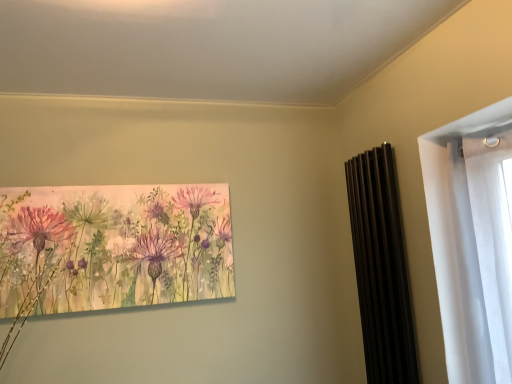
Question: From the image's perspective, is black matte radiator at right under watercolor painting of flowers at center?

Choices:
 (A) no
 (B) yes

Answer: (B)

Question: Considering the relative sizes of black matte radiator at right and watercolor painting of flowers at center in the image provided, is black matte radiator at right smaller than watercolor painting of flowers at center?

Choices:
 (A) yes
 (B) no

Answer: (B)

Question: Is black matte radiator at right turned away from watercolor painting of flowers at center?

Choices:
 (A) no
 (B) yes

Answer: (A)

Question: Is the position of black matte radiator at right more distant than that of watercolor painting of flowers at center?

Choices:
 (A) no
 (B) yes

Answer: (A)

Question: Are black matte radiator at right and watercolor painting of flowers at center far apart?

Choices:
 (A) yes
 (B) no

Answer: (A)

Question: Is watercolor painting of flowers at center a part of black matte radiator at right?

Choices:
 (A) no
 (B) yes

Answer: (A)

Question: Is watercolor painting of flowers at center closer to the viewer compared to black matte radiator at right?

Choices:
 (A) no
 (B) yes

Answer: (A)

Question: Could you tell me if watercolor painting of flowers at center is facing black matte radiator at right?

Choices:
 (A) no
 (B) yes

Answer: (A)

Question: Is black matte radiator at right a part of watercolor painting of flowers at center?

Choices:
 (A) no
 (B) yes

Answer: (A)

Question: From a real-world perspective, is watercolor painting of flowers at center below black matte radiator at right?

Choices:
 (A) yes
 (B) no

Answer: (B)

Question: Considering the relative sizes of watercolor painting of flowers at center and black matte radiator at right in the image provided, is watercolor painting of flowers at center taller than black matte radiator at right?

Choices:
 (A) yes
 (B) no

Answer: (B)

Question: Can you confirm if watercolor painting of flowers at center is shorter than black matte radiator at right?

Choices:
 (A) no
 (B) yes

Answer: (B)

Question: Is black matte radiator at right taller or shorter than watercolor painting of flowers at center?

Choices:
 (A) tall
 (B) short

Answer: (A)